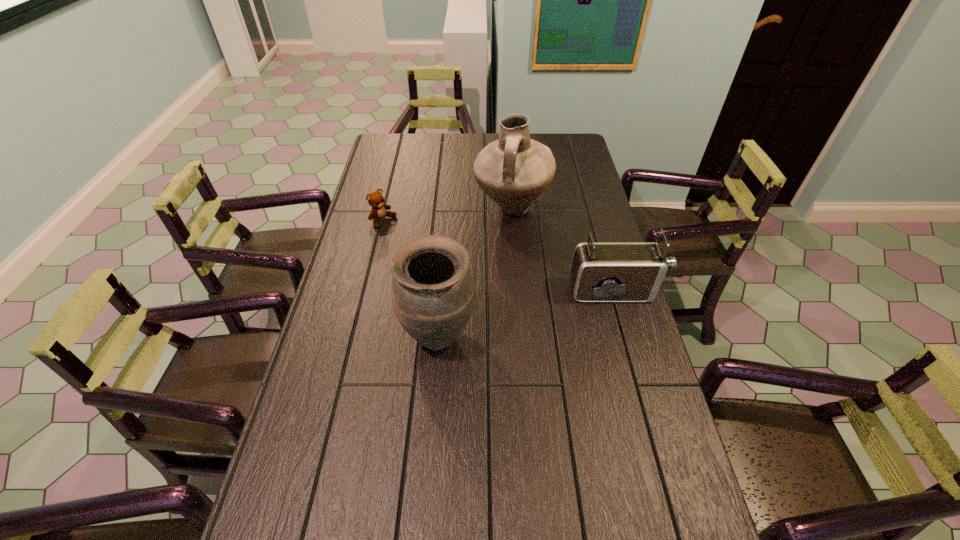
The height and width of the screenshot is (540, 960). I want to click on urn, so click(x=432, y=292).

I want to click on the nearest object, so click(432, 292).

I want to click on the rightmost object, so click(x=601, y=271).

Image resolution: width=960 pixels, height=540 pixels. Find the location of `the third farthest object`. the third farthest object is located at coordinates (601, 271).

Where is `the shortest object`? Image resolution: width=960 pixels, height=540 pixels. the shortest object is located at coordinates (376, 200).

This screenshot has height=540, width=960. I want to click on the leftmost object, so click(376, 200).

In order to click on pitcher in this screenshot , I will do `click(514, 170)`.

Where is `vacant space situated on the front of the second tallest object`? vacant space situated on the front of the second tallest object is located at coordinates click(x=425, y=483).

Where is `blank space located 0.190m on the front-facing side of the shortest object`? blank space located 0.190m on the front-facing side of the shortest object is located at coordinates (426, 251).

Where is `free space located 0.350m on the front-facing side of the shortest object`? The image size is (960, 540). free space located 0.350m on the front-facing side of the shortest object is located at coordinates (459, 274).